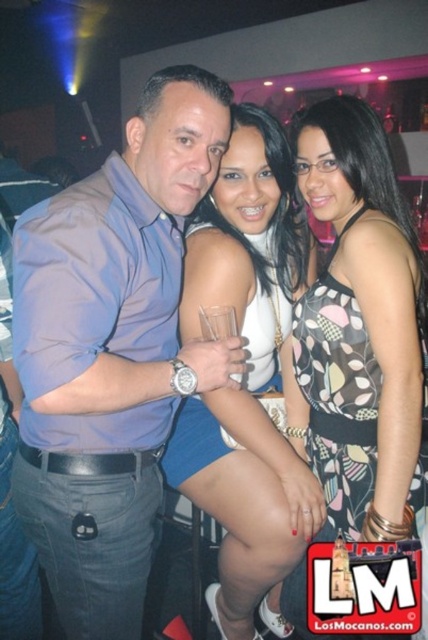
Question: Is matte blue shirt at center bigger than printed fabric dress at center?

Choices:
 (A) yes
 (B) no

Answer: (A)

Question: Is matte blue shirt at center above matte white tank top at center?

Choices:
 (A) yes
 (B) no

Answer: (A)

Question: Based on their relative distances, which object is farther from the printed fabric dress at center?

Choices:
 (A) matte blue shirt at center
 (B) matte white tank top at center

Answer: (A)

Question: Which of the following is the closest to the observer?

Choices:
 (A) (247, 253)
 (B) (359, 118)

Answer: (B)

Question: Does printed fabric dress at center have a smaller size compared to matte white tank top at center?

Choices:
 (A) yes
 (B) no

Answer: (A)

Question: Which point is closer to the camera?

Choices:
 (A) matte blue shirt at center
 (B) printed fabric dress at center
 (C) matte white tank top at center

Answer: (A)